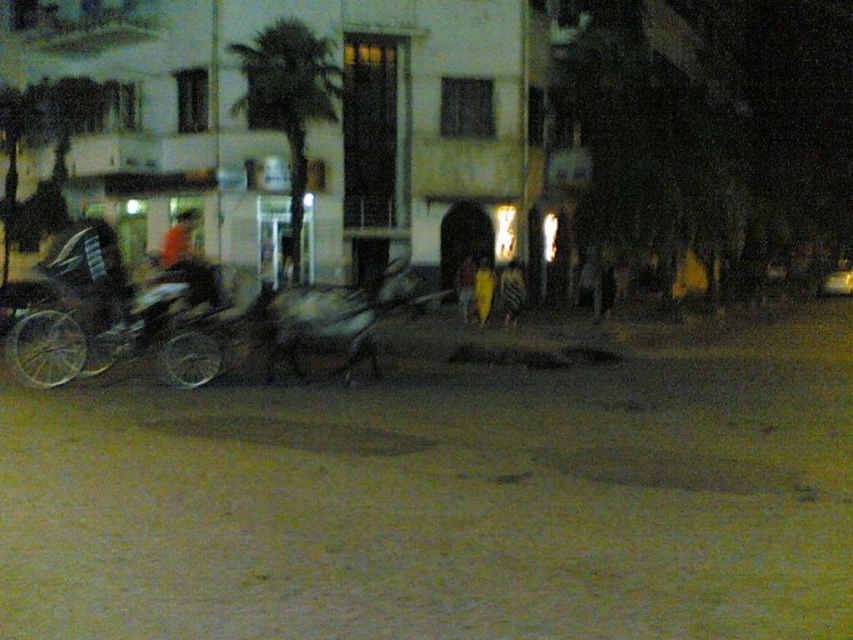
You are a delivery person who needs to navigate through the nighttime urban scene. You see a green leafy palm tree at center and a dark fabric shirt at center. Which object is narrower in width?

The green leafy palm tree at center is thinner than the dark fabric shirt at center, so the green leafy palm tree at center is narrower in width.

You are a delivery person who needs to place a package on the ground near the dark fabric shirt at center without hitting the green leafy palm tree at center. Is there enough space between them to do this?

The green leafy palm tree at center is positioned over the dark fabric shirt at center, so placing a package on the ground near the dark fabric shirt at center would not require moving the palm tree since it is above, not beside it.